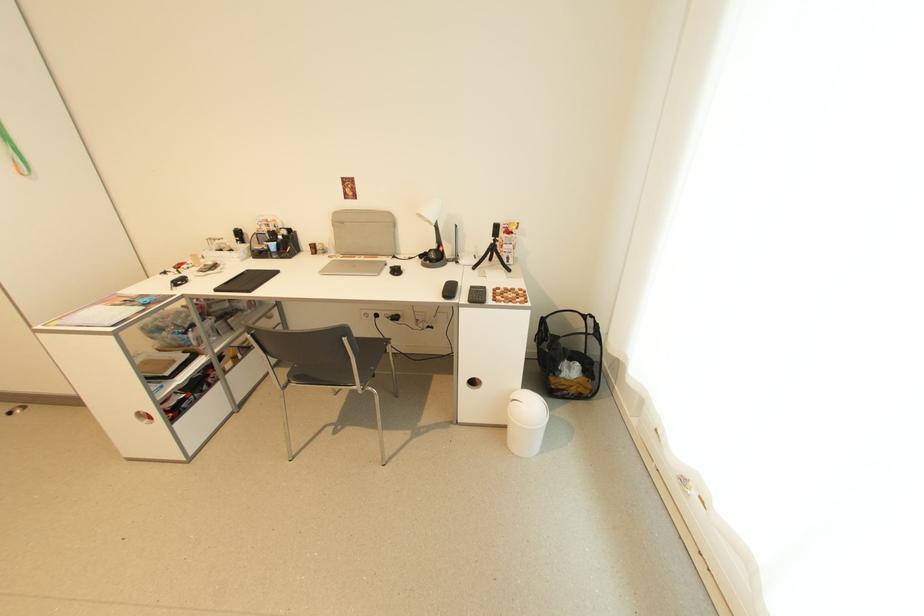
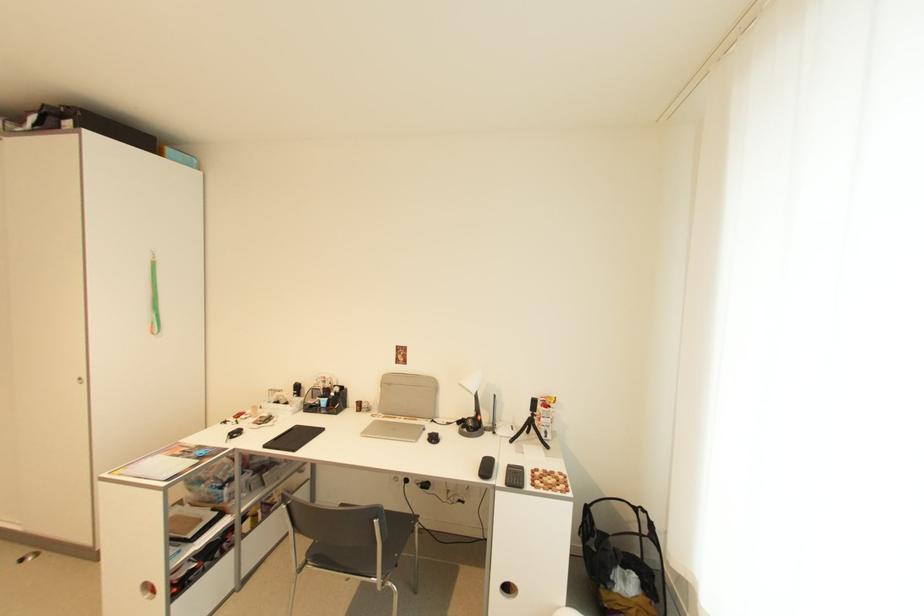
Question: How did the camera likely rotate?

Choices:
 (A) Left
 (B) Right
 (C) Up
 (D) Down

Answer: (C)